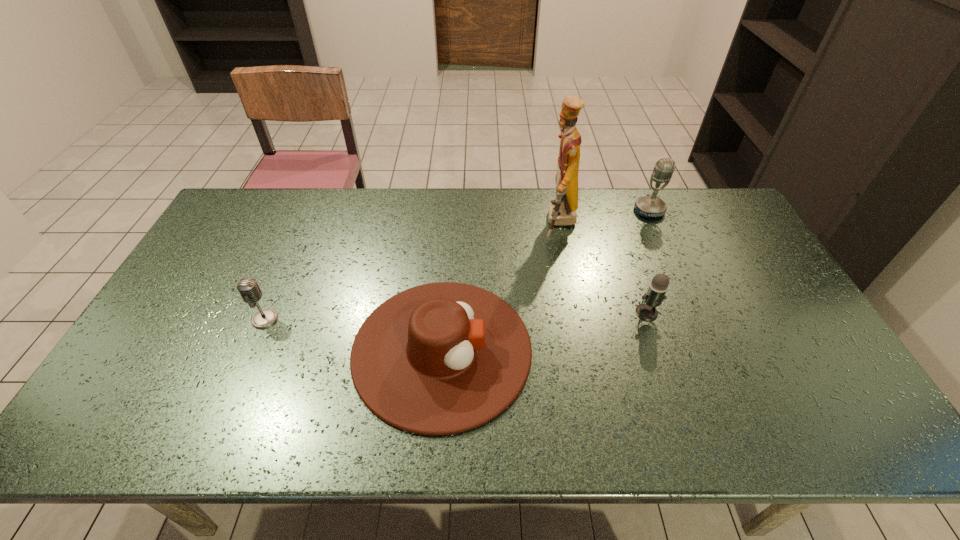
Where is `vacant space that is in between the third object from left to right and the second object from left to right`? vacant space that is in between the third object from left to right and the second object from left to right is located at coordinates (501, 287).

At what (x,y) coordinates should I click in order to perform the action: click on the fourth closest object to the nutcracker. Please return your answer as a coordinate pair (x, y). The width and height of the screenshot is (960, 540). Looking at the image, I should click on (248, 288).

Image resolution: width=960 pixels, height=540 pixels. Find the location of `the third closest object to the third object from right to left`. the third closest object to the third object from right to left is located at coordinates (655, 294).

Point out which microphone is positioned as the nearest to the leftmost object. Please provide its 2D coordinates. Your answer should be formatted as a tuple, i.e. [(x, y)], where the tuple contains the x and y coordinates of a point satisfying the conditions above.

[(655, 294)]

Identify which microphone is the second nearest to the nutcracker. Please provide its 2D coordinates. Your answer should be formatted as a tuple, i.e. [(x, y)], where the tuple contains the x and y coordinates of a point satisfying the conditions above.

[(655, 294)]

The height and width of the screenshot is (540, 960). Identify the location of blank area in the image that satisfies the following two spatial constraints: 1. on the front-facing side of the second microphone from right to left; 2. on the left side of the tallest object. (577, 312).

Where is `free point that satisfies the following two spatial constraints: 1. on the front-facing side of the tallest microphone; 2. on the front-facing side of the nutcracker`? free point that satisfies the following two spatial constraints: 1. on the front-facing side of the tallest microphone; 2. on the front-facing side of the nutcracker is located at coordinates (655, 223).